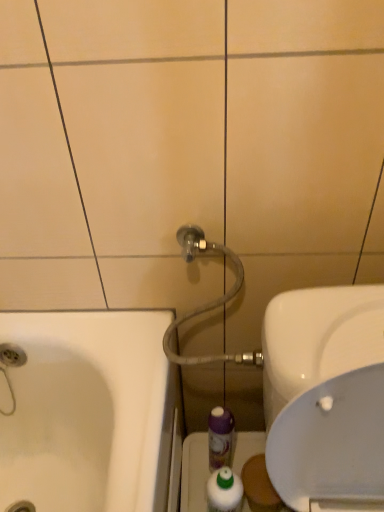
Question: From a real-world perspective, is white glossy mouthwash at lower center, the 2th mouthwash positioned from the back, located higher than matte gray hose at upper center?

Choices:
 (A) no
 (B) yes

Answer: (A)

Question: Is white glossy mouthwash at lower center, the 2th mouthwash positioned from the back, to the right of matte gray hose at upper center from the viewer's perspective?

Choices:
 (A) no
 (B) yes

Answer: (B)

Question: From a real-world perspective, is white glossy mouthwash at lower center, the 2th mouthwash positioned from the back, under matte gray hose at upper center?

Choices:
 (A) yes
 (B) no

Answer: (A)

Question: Can we say white glossy mouthwash at lower center, the 2th mouthwash positioned from the back, lies outside matte gray hose at upper center?

Choices:
 (A) no
 (B) yes

Answer: (B)

Question: Is white glossy mouthwash at lower center, the 2th mouthwash positioned from the back, thinner than matte gray hose at upper center?

Choices:
 (A) no
 (B) yes

Answer: (B)

Question: Is purple plastic mouthwash at center, which is the 1th mouthwash from back to front, taller or shorter than transparent plastic bottle at lower center?

Choices:
 (A) tall
 (B) short

Answer: (A)

Question: Is purple plastic mouthwash at center, the 2th mouthwash viewed from the front, spatially inside transparent plastic bottle at lower center, or outside of it?

Choices:
 (A) inside
 (B) outside

Answer: (B)

Question: From the image's perspective, is purple plastic mouthwash at center, the 2th mouthwash viewed from the front, positioned above or below transparent plastic bottle at lower center?

Choices:
 (A) above
 (B) below

Answer: (A)

Question: Does point (223, 441) appear closer or farther from the camera than point (192, 468)?

Choices:
 (A) farther
 (B) closer

Answer: (B)

Question: Is white glossy sink at right in front of or behind white glossy mouthwash at lower center, the 1th mouthwash viewed from the front, in the image?

Choices:
 (A) behind
 (B) front

Answer: (B)

Question: From a real-world perspective, relative to white glossy mouthwash at lower center, the 1th mouthwash viewed from the front, is white glossy sink at right vertically above or below?

Choices:
 (A) above
 (B) below

Answer: (A)

Question: Would you say white glossy sink at right is to the left or to the right of white glossy mouthwash at lower center, the 1th mouthwash viewed from the front, in the picture?

Choices:
 (A) left
 (B) right

Answer: (B)

Question: Considering the positions of white glossy sink at right and white glossy mouthwash at lower center, the 1th mouthwash viewed from the front, in the image, is white glossy sink at right wider or thinner than white glossy mouthwash at lower center, the 1th mouthwash viewed from the front,?

Choices:
 (A) thin
 (B) wide

Answer: (B)

Question: Is purple plastic mouthwash at center, the 2th mouthwash viewed from the front, taller or shorter than white glossy mouthwash at lower center, the 2th mouthwash positioned from the back?

Choices:
 (A) tall
 (B) short

Answer: (A)

Question: Based on their positions, is purple plastic mouthwash at center, which is the 1th mouthwash from back to front, located to the left or right of white glossy mouthwash at lower center, the 2th mouthwash positioned from the back?

Choices:
 (A) left
 (B) right

Answer: (B)